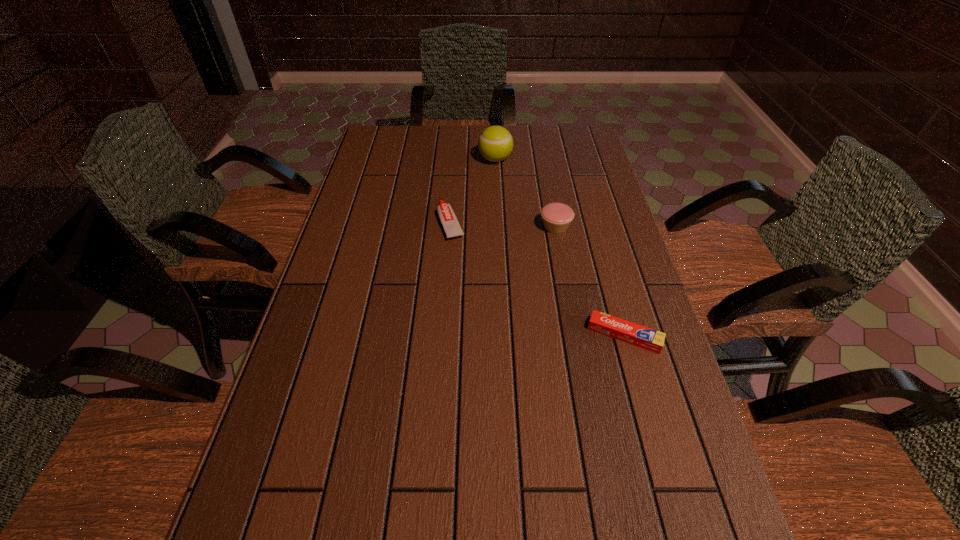
Locate an element on the screen. Image resolution: width=960 pixels, height=540 pixels. blank area in the image that satisfies the following two spatial constraints: 1. on the back side of the second object from left to right; 2. on the left side of the taller toothpaste is located at coordinates (455, 159).

Locate an element on the screen. This screenshot has width=960, height=540. free spot that satisfies the following two spatial constraints: 1. on the front side of the nearest object; 2. on the left side of the cupcake is located at coordinates (576, 335).